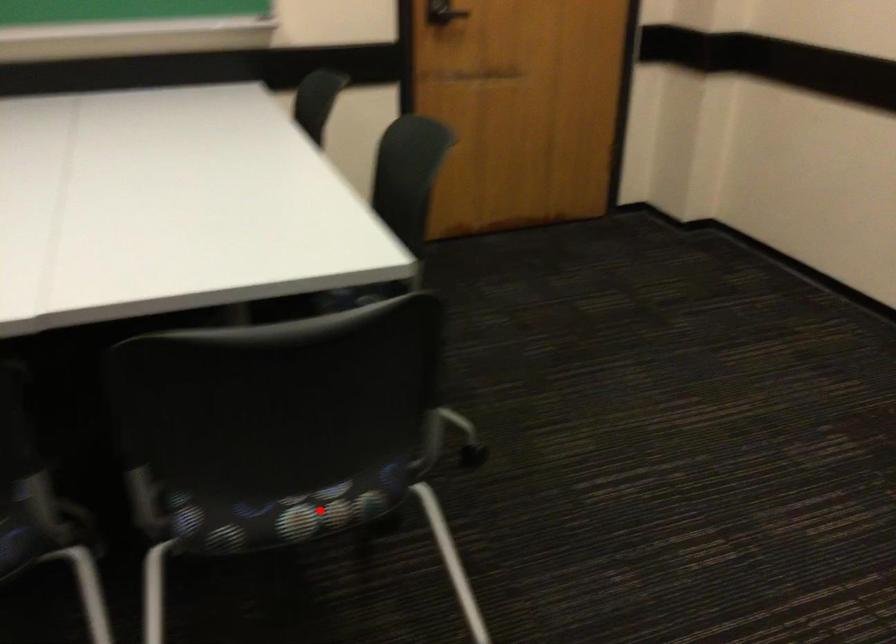
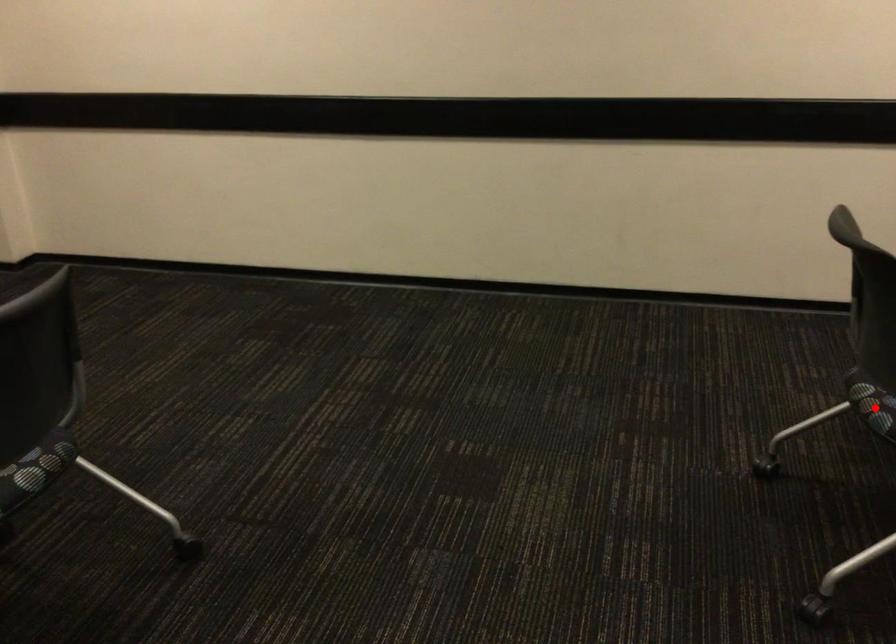
Based on the photo, I am providing you with two images of the same scene from different viewpoints. A red point is marked on the first image and another point is marked on the second image. Is the red point in image1 aligned with the point shown in image2?

No